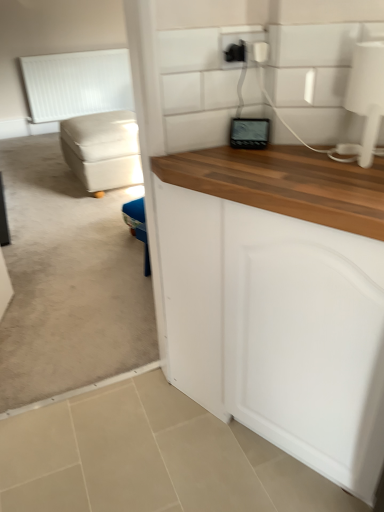
Question: In terms of width, does beige fabric ottoman at left look wider or thinner when compared to black plastic outlet at upper center?

Choices:
 (A) wide
 (B) thin

Answer: (A)

Question: From their relative heights in the image, would you say beige fabric ottoman at left is taller or shorter than black plastic outlet at upper center?

Choices:
 (A) short
 (B) tall

Answer: (B)

Question: Estimate the real-world distances between objects in this image. Which object is closer to the black plastic outlet at upper center?

Choices:
 (A) beige fabric ottoman at left
 (B) white matte radiator at upper left

Answer: (A)

Question: Estimate the real-world distances between objects in this image. Which object is closer to the beige fabric ottoman at left?

Choices:
 (A) white matte radiator at upper left
 (B) black plastic outlet at upper center

Answer: (B)